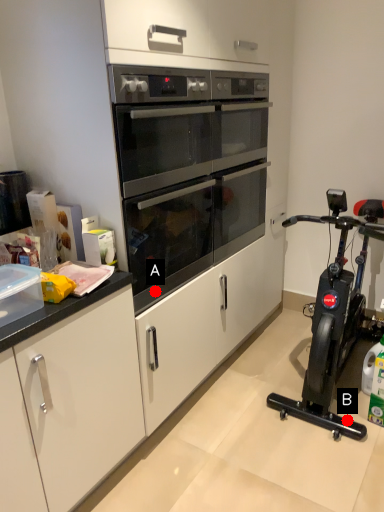
Question: Two points are circled on the image, labeled by A and B beside each circle. Which point is closer to the camera taking this photo?

Choices:
 (A) A is closer
 (B) B is closer

Answer: (A)